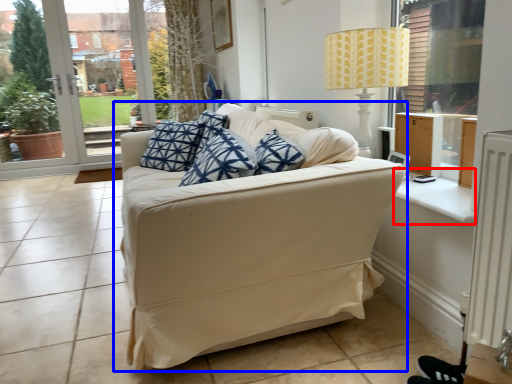
Question: Which object appears closest to the camera in this image, window sill (highlighted by a red box) or studio couch (highlighted by a blue box)?

Choices:
 (A) window sill
 (B) studio couch

Answer: (B)